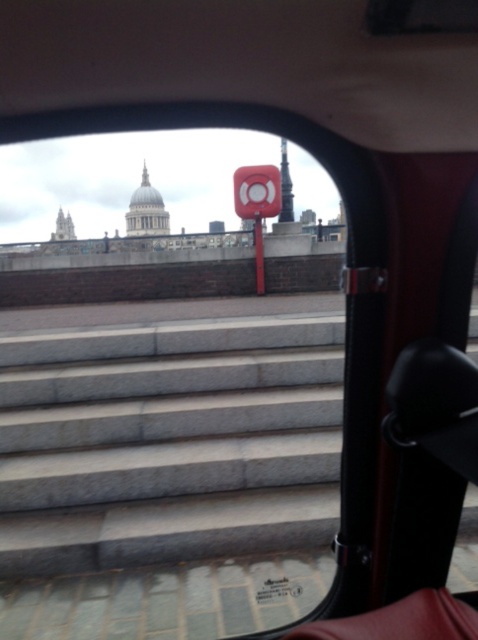
Does gray concrete stairs at center have a smaller size compared to black plastic rearview mirror at upper right?

Incorrect, gray concrete stairs at center is not smaller in size than black plastic rearview mirror at upper right.

Is gray concrete stairs at center below black plastic rearview mirror at upper right?

Yes, gray concrete stairs at center is below black plastic rearview mirror at upper right.

Locate an element on the screen. The image size is (478, 640). gray concrete stairs at center is located at coordinates (169, 442).

Where is `gray concrete stairs at center`? gray concrete stairs at center is located at coordinates (169, 442).